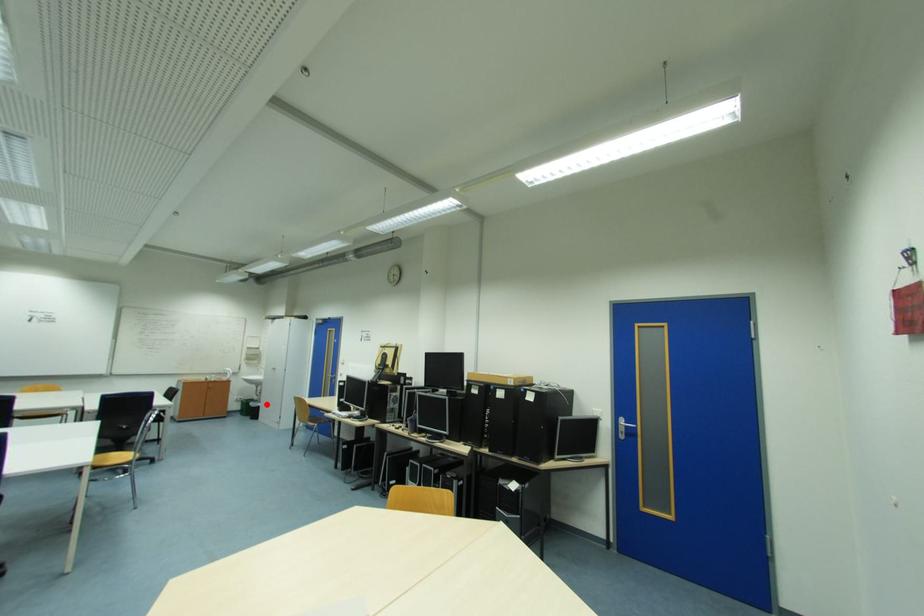
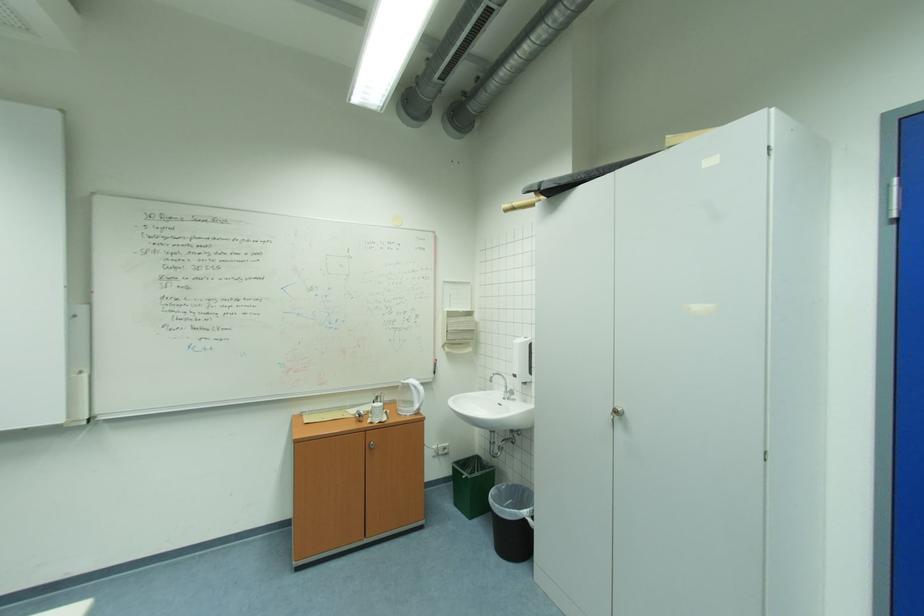
Find the pixel in the second image that matches the highlighted location in the first image.

(532, 513)